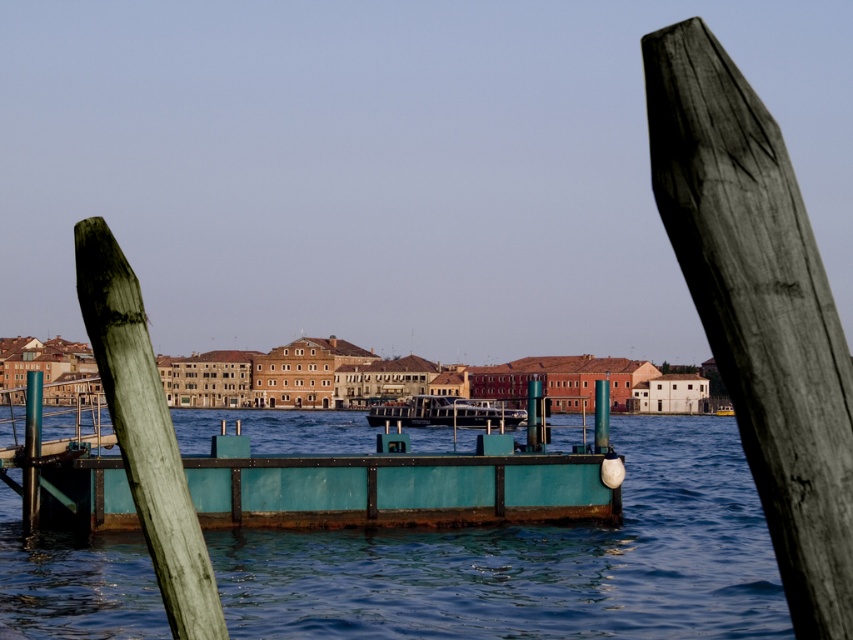
You are standing on the teal painted wood dock at center and want to reach the metallic green post at center. Which direction should you move to get closer to the post?

The teal painted wood dock at center is not as tall as metallic green post at center, so you should move towards the post to get closer.